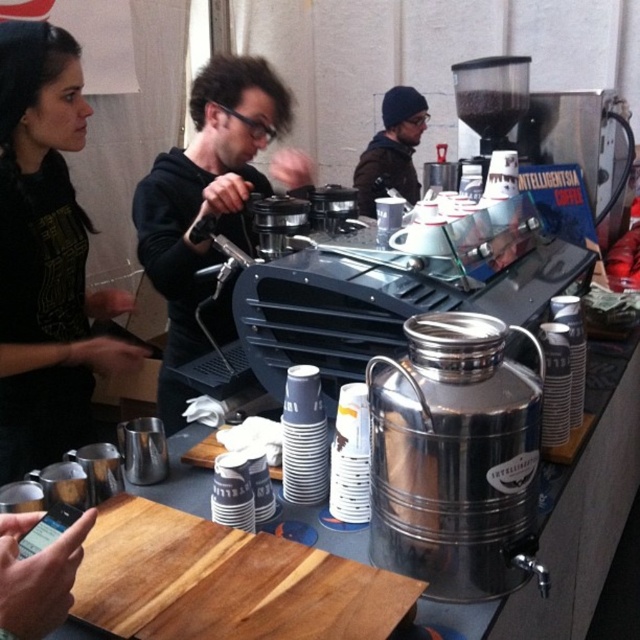
You are standing in the coffee shop and want to locate the black matte hoodie at center. According to the coordinates provided, where would you look to find it?

The black matte hoodie at center is located at point coordinates (x=204, y=202).

You are a barista working in the coffee shop. You need to reach both the black fabric shirt at left and the brown fuzzy beanie at upper center. Given that your arm can extend 2 meters, can you comfortably reach both items without moving your position?

The black fabric shirt at left and brown fuzzy beanie at upper center are 6.42 feet apart from each other. Since 6.42 feet is approximately 1.96 meters, which is just under your arm extension limit of 2 meters, you can comfortably reach both items without moving your position.

You are a customer in the coffee shop and want to ask the barista for a refill. The barista is wearing the black fabric shirt at left. If you stand at the counter where the smartphone is visible, which direction should you turn to face the barista?

Since the black fabric shirt at left is located at point (x=45, y=256), you should turn to your left to face the barista wearing the black fabric shirt at left.